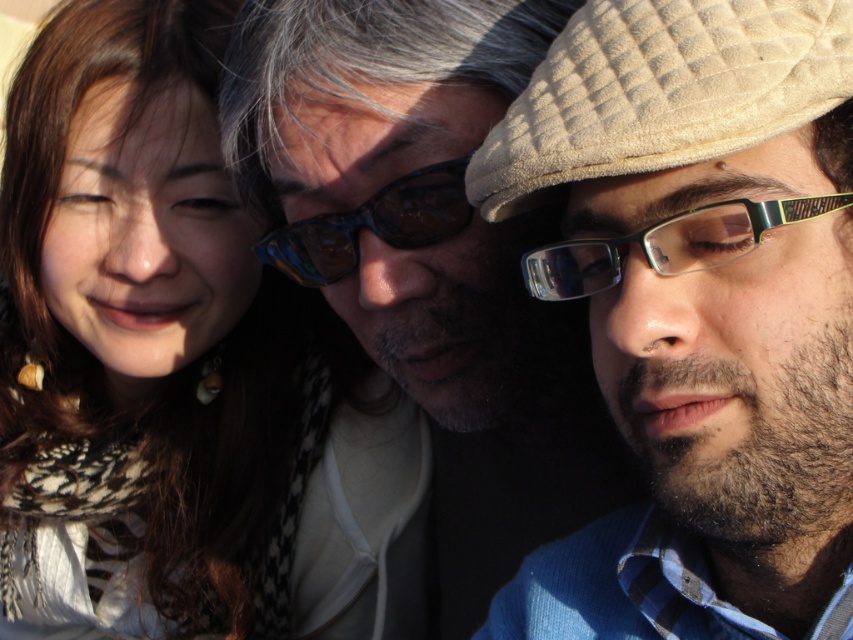
Is point (735, 232) positioned before point (461, 220)?

Yes, point (735, 232) is closer to viewer.

Does clear plastic glasses at center have a greater height compared to translucent blue plastic goggles at center?

No, clear plastic glasses at center is not taller than translucent blue plastic goggles at center.

Is point (554, 257) farther from viewer compared to point (453, 179)?

That is False.

At what (x,y) coordinates should I click in order to perform the action: click on clear plastic glasses at center. Please return your answer as a coordinate pair (x, y). This screenshot has height=640, width=853. Looking at the image, I should click on (666, 244).

Is sunglasses at center to the right of translucent blue plastic goggles at center from the viewer's perspective?

Yes, sunglasses at center is to the right of translucent blue plastic goggles at center.

Is point (560, 432) positioned before point (431, 166)?

No, (560, 432) is further to viewer.

Identify the location of sunglasses at center. Image resolution: width=853 pixels, height=640 pixels. (427, 257).

Is matte black scarf at upper left wider than beige textured cap at upper right?

Indeed, matte black scarf at upper left has a greater width compared to beige textured cap at upper right.

Consider the image. Is matte black scarf at upper left below beige textured cap at upper right?

Yes, matte black scarf at upper left is below beige textured cap at upper right.

Is point (219, 58) positioned before point (637, 36)?

That is False.

Where is `matte black scarf at upper left`? The width and height of the screenshot is (853, 640). matte black scarf at upper left is located at coordinates (177, 371).